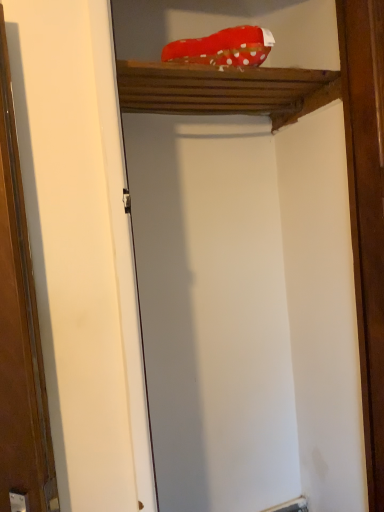
Question: Is brown wood at right spatially inside wooden shelf at upper center, or outside of it?

Choices:
 (A) outside
 (B) inside

Answer: (A)

Question: From the image's perspective, is brown wood at right positioned above or below wooden shelf at upper center?

Choices:
 (A) above
 (B) below

Answer: (B)

Question: Is brown wood at right bigger or smaller than wooden shelf at upper center?

Choices:
 (A) small
 (B) big

Answer: (A)

Question: Is wooden shelf at upper center wider or thinner than brown wood at right?

Choices:
 (A) wide
 (B) thin

Answer: (A)

Question: Considering the positions of point (208, 22) and point (349, 32), is point (208, 22) closer or farther from the camera than point (349, 32)?

Choices:
 (A) closer
 (B) farther

Answer: (B)

Question: From a real-world perspective, is wooden shelf at upper center physically located above or below brown wood at right?

Choices:
 (A) above
 (B) below

Answer: (A)

Question: In terms of height, does wooden shelf at upper center look taller or shorter compared to brown wood at right?

Choices:
 (A) short
 (B) tall

Answer: (A)